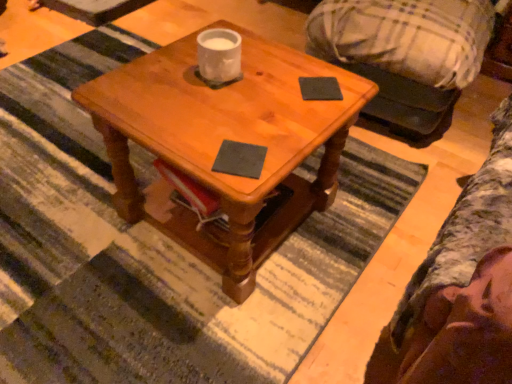
Question: From the image's perspective, is black matte notepad at upper right, positioned as the first notepad in top-to-bottom order, positioned above or below wooden coffee table at center?

Choices:
 (A) below
 (B) above

Answer: (B)

Question: Is black matte notepad at upper right, the 1th notepad viewed from the back, bigger or smaller than wooden coffee table at center?

Choices:
 (A) big
 (B) small

Answer: (B)

Question: Estimate the real-world distances between objects in this image. Which object is closer to the black matte notepad at upper right, positioned as the first notepad in top-to-bottom order?

Choices:
 (A) dark gray matte notepad at center, which is counted as the second notepad, starting from the back
 (B) wooden coffee table at center

Answer: (A)

Question: Which object is the farthest from the wooden coffee table at center?

Choices:
 (A) black matte notepad at upper right, the second notepad viewed from the front
 (B) dark gray matte notepad at center, the first notepad positioned from the left

Answer: (A)